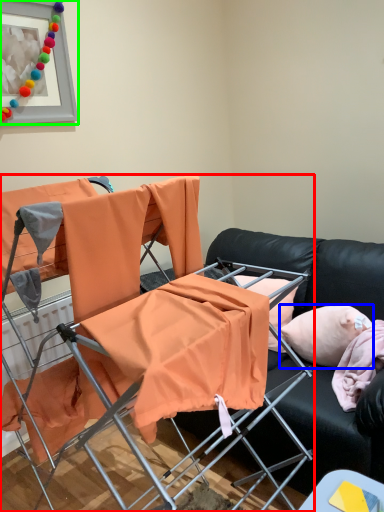
Question: Which object is the closest to the chair (highlighted by a red box)? Choose among these: pillow (highlighted by a blue box) or picture frame (highlighted by a green box).

Choices:
 (A) pillow
 (B) picture frame

Answer: (A)